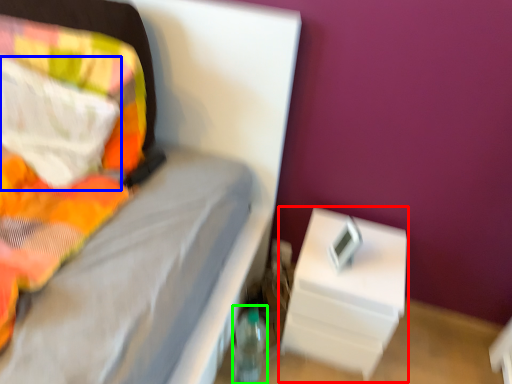
Question: Based on their relative distances, which object is farther from nightstand (highlighted by a red box)? Choose from pillow (highlighted by a blue box) and bottle (highlighted by a green box).

Choices:
 (A) pillow
 (B) bottle

Answer: (A)